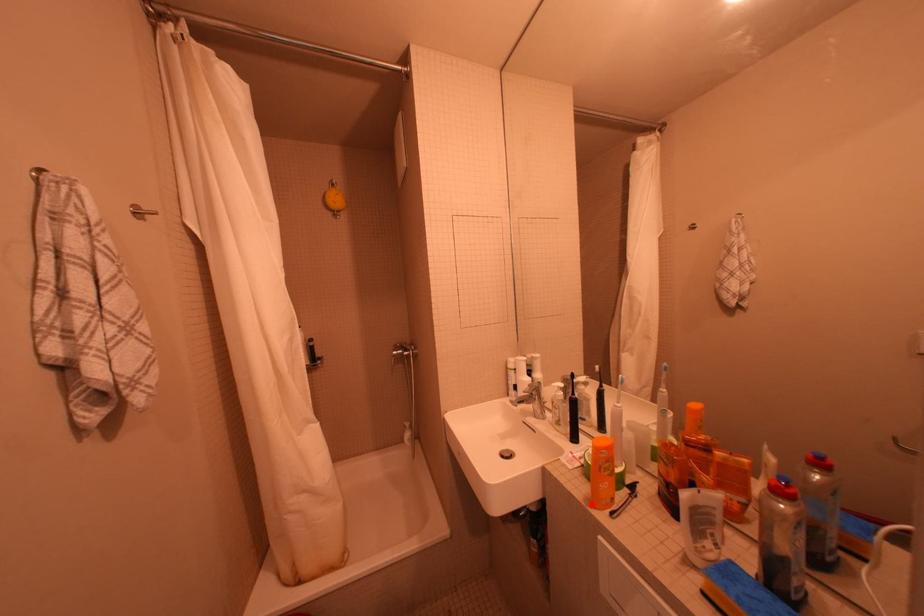
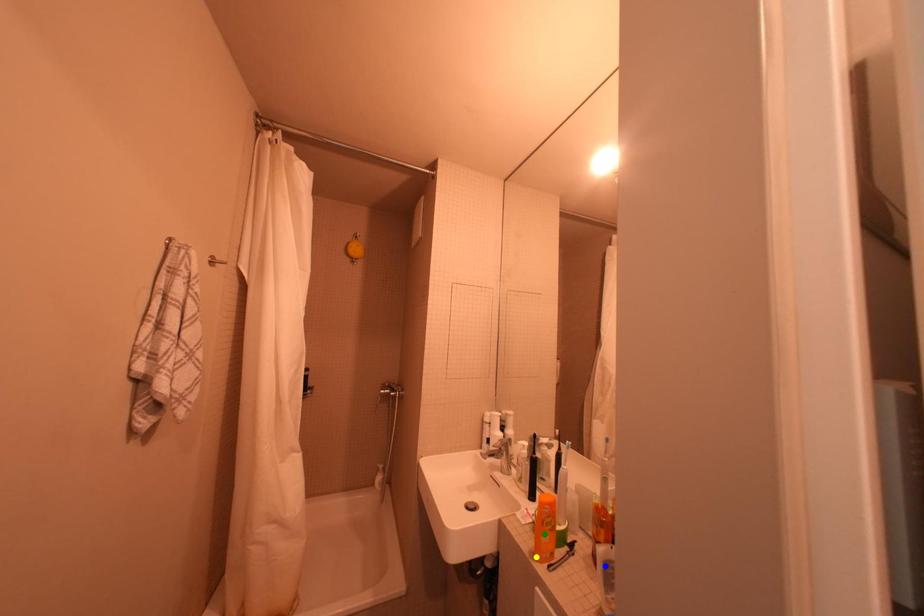
Question: I am providing you with two images of the same scene from different viewpoints. A red point is marked on the first image. You are given multiple points on the second image. Which point in image 2 represents the same 3d spot as the red point in image 1?

Choices:
 (A) blue point
 (B) green point
 (C) yellow point

Answer: (C)